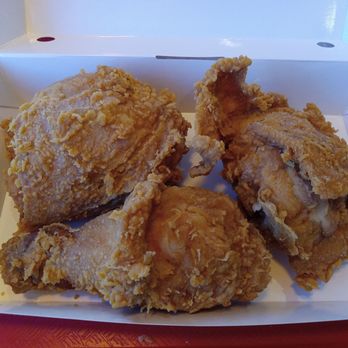
At what (x,y) coordinates should I click in order to perform the action: click on table. Please return your answer as a coordinate pair (x, y). Image resolution: width=348 pixels, height=348 pixels. Looking at the image, I should click on (40, 328).